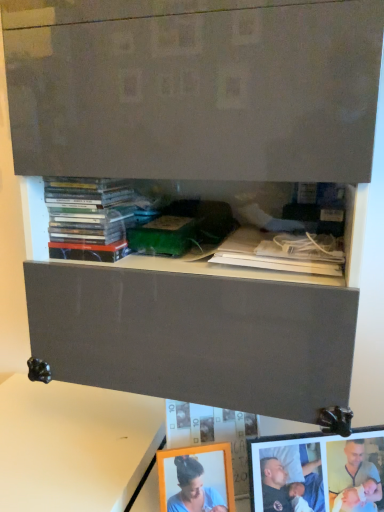
Where is `empty space that is ontop of white matte table at lower left (from a real-world perspective)`? This screenshot has height=512, width=384. empty space that is ontop of white matte table at lower left (from a real-world perspective) is located at coordinates (75, 424).